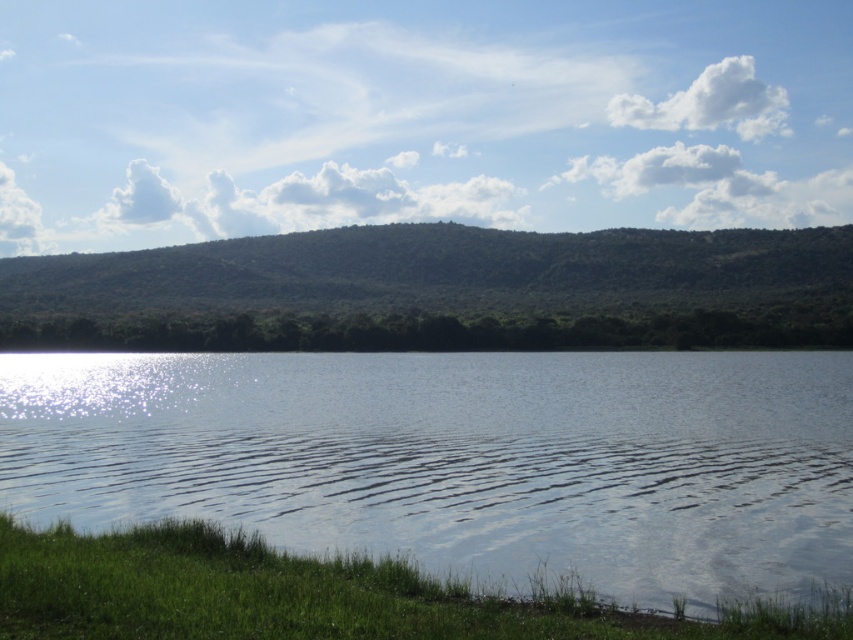
Which is in front, point (416, 538) or point (689, 268)?

Point (416, 538) is in front.

Is clear water at lower center thinner than green leafy hill at center?

Yes.

Does point (637, 428) come closer to viewer compared to point (325, 321)?

Yes.

Where is `clear water at lower center`? The height and width of the screenshot is (640, 853). clear water at lower center is located at coordinates (460, 458).

Does point (730, 305) lie in front of point (438, 480)?

No, it is not.

Who is more forward, (808, 243) or (590, 456)?

Point (590, 456)

Locate an element on the screen. The width and height of the screenshot is (853, 640). green leafy hill at center is located at coordinates (440, 291).

Locate an element on the screen. clear water at lower center is located at coordinates (460, 458).

Can you confirm if clear water at lower center is positioned below clear water ripple at lower center?

No, clear water at lower center is not below clear water ripple at lower center.

Between point (747, 353) and point (85, 490), which one is positioned in front?

Point (85, 490) is in front.

Image resolution: width=853 pixels, height=640 pixels. Identify the location of clear water at lower center. (460, 458).